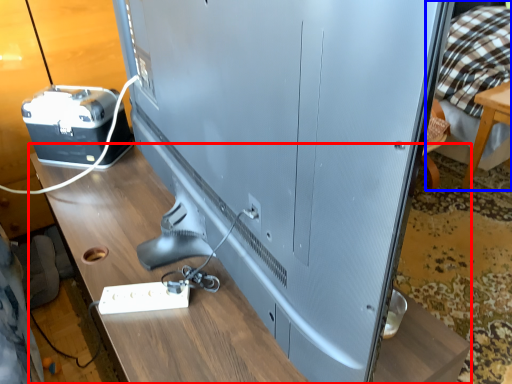
Question: Among these objects, which one is nearest to the camera, table (highlighted by a red box) or bed (highlighted by a blue box)?

Choices:
 (A) table
 (B) bed

Answer: (A)